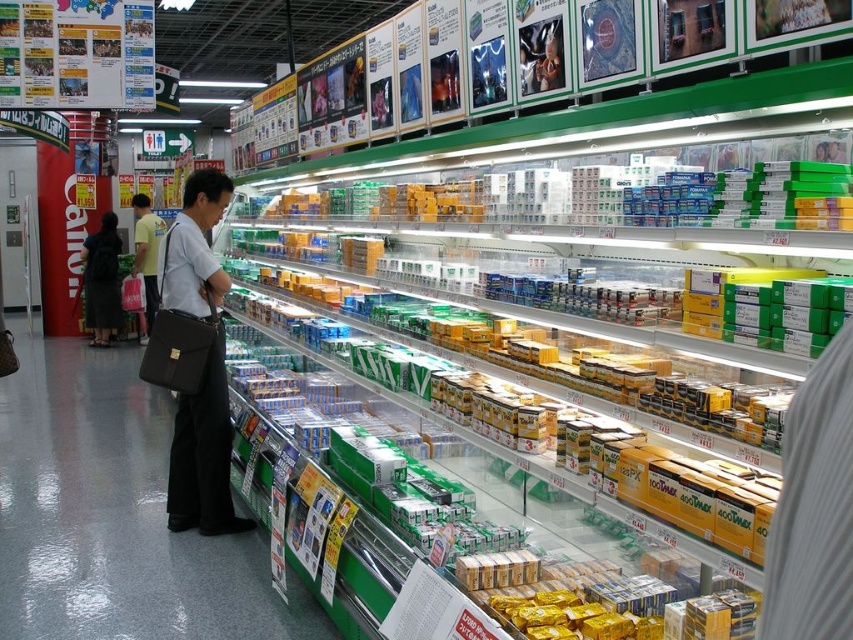
Who is positioned more to the right, matte black briefcase at center or dark gray fabric briefcase at center?

dark gray fabric briefcase at center is more to the right.

Does point (3, 438) come farther from viewer compared to point (206, 282)?

Yes, it is behind point (206, 282).

Image resolution: width=853 pixels, height=640 pixels. Describe the element at coordinates (114, 516) in the screenshot. I see `matte black briefcase at center` at that location.

In order to click on matte black briefcase at center in this screenshot , I will do `click(114, 516)`.

Can you confirm if matte black briefcase at center is wider than light blue shirt at center?

Yes, matte black briefcase at center is wider than light blue shirt at center.

Who is lower down, matte black briefcase at center or light blue shirt at center?

matte black briefcase at center

This screenshot has width=853, height=640. Identify the location of matte black briefcase at center. (114, 516).

Between dark gray fabric briefcase at center and dark gray dress at center, which one is positioned lower?

dark gray fabric briefcase at center

Between point (175, 301) and point (91, 240), which one is positioned in front?

Point (175, 301) is in front.

The image size is (853, 640). What are the coordinates of `dark gray fabric briefcase at center` in the screenshot? It's located at (204, 364).